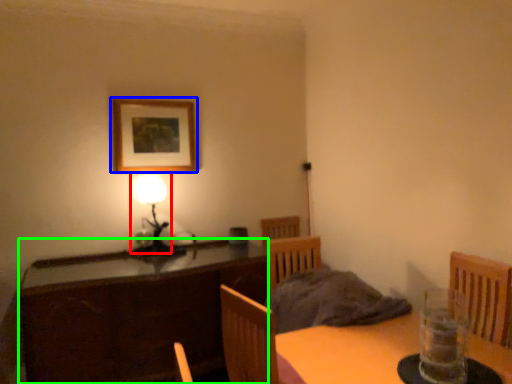
Question: Estimate the real-world distances between objects in this image. Which object is closer to table lamp (highlighted by a red box), picture frame (highlighted by a blue box) or cabinetry (highlighted by a green box)?

Choices:
 (A) picture frame
 (B) cabinetry

Answer: (A)